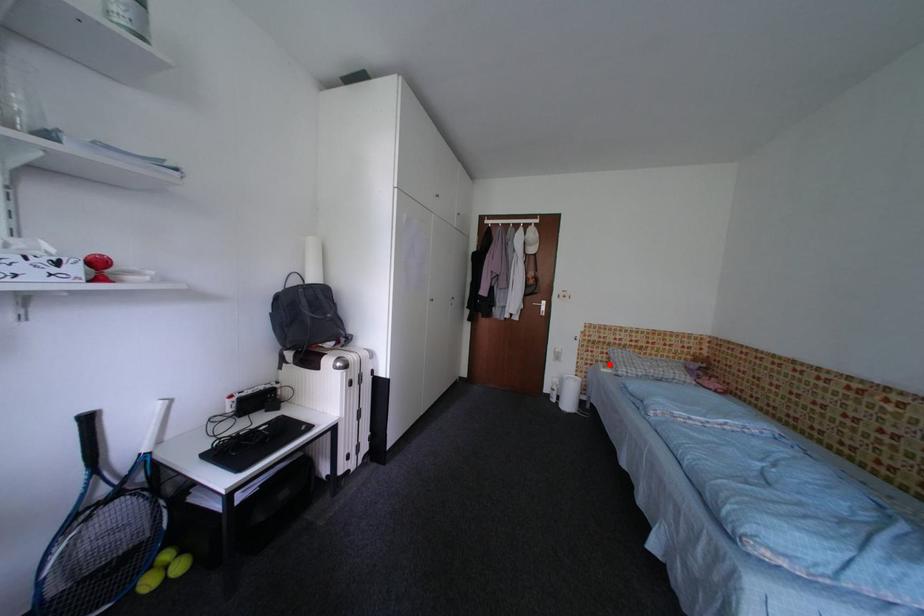
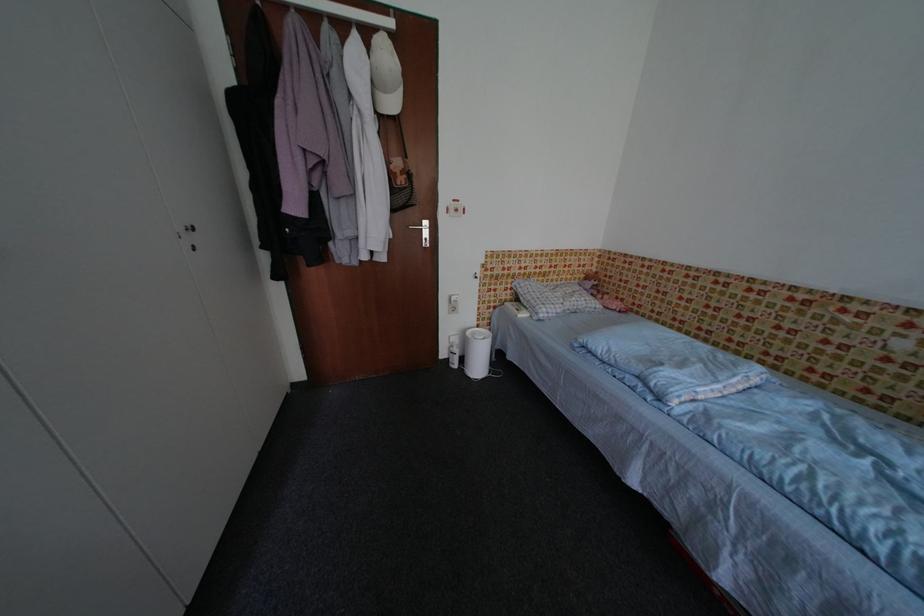
In the second image, find the point that corresponds to the highlighted location in the first image.

(514, 302)